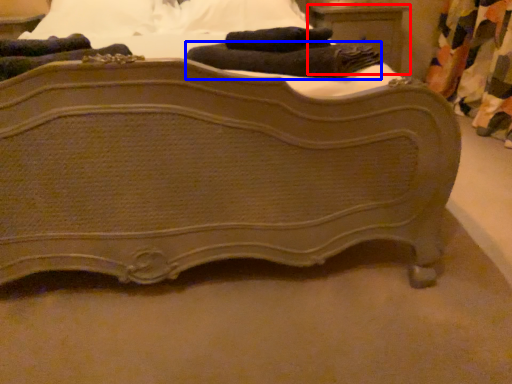
Question: Which point is further to the camera, nightstand (highlighted by a red box) or bath towel (highlighted by a blue box)?

Choices:
 (A) nightstand
 (B) bath towel

Answer: (A)